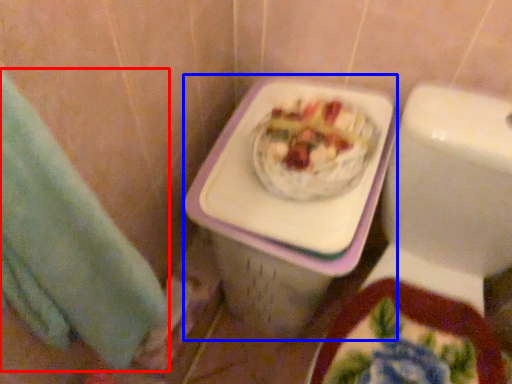
Question: Among these objects, which one is farthest to the camera, hand towel (highlighted by a red box) or porcelain (highlighted by a blue box)?

Choices:
 (A) hand towel
 (B) porcelain

Answer: (B)